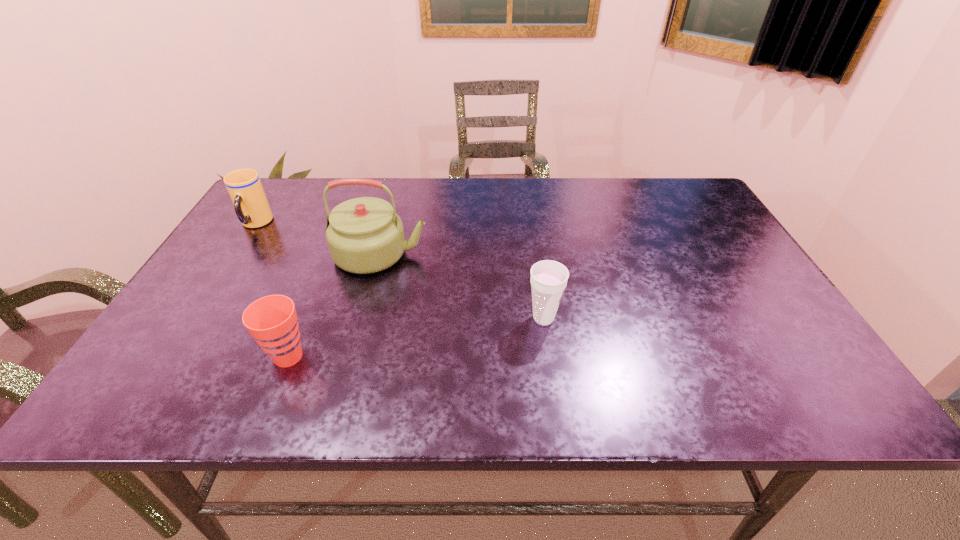
Identify the location of free space located on the back of the nearest object. The image size is (960, 540). (337, 237).

Locate an element on the screen. The height and width of the screenshot is (540, 960). object at the far edge is located at coordinates (244, 186).

Locate an element on the screen. The image size is (960, 540). object present at the near edge is located at coordinates (272, 320).

Find the location of a particular element. This screenshot has width=960, height=540. object situated at the left edge is located at coordinates (x=244, y=186).

Identify the location of object positioned at the far left corner. Image resolution: width=960 pixels, height=540 pixels. (244, 186).

Image resolution: width=960 pixels, height=540 pixels. In the image, there is a desktop. In order to click on vacant space at the far edge in this screenshot , I will do `click(461, 218)`.

In the image, there is a desktop. Identify the location of vacant area at the left edge. The height and width of the screenshot is (540, 960). (252, 252).

Where is `free space at the right edge of the desktop`? free space at the right edge of the desktop is located at coordinates (715, 294).

In the image, there is a desktop. Identify the location of vacant space at the far left corner. This screenshot has width=960, height=540. (276, 205).

The height and width of the screenshot is (540, 960). I want to click on vacant space at the near left corner of the desktop, so click(x=187, y=406).